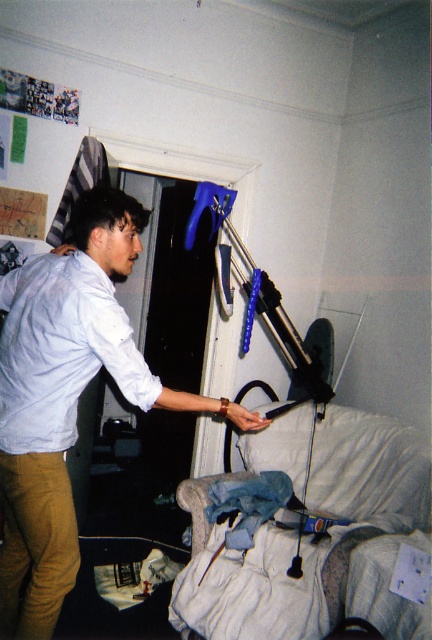
You are standing in the living room and want to know which of the two points, point (120, 364) or point (12, 333), is nearer to you. Based on the scene description, which point is closer?

Point (120, 364) is closer to the camera than point (12, 333), so the point closer to you is point (120, 364).

You are a nurse who needs to check the patient on the velvet blue hospital bed at lower right. Considering your height of 5 feet 6 inches, can you comfortably reach the bed controls located at the head of the bed without needing a stool?

The velvet blue hospital bed at lower right is 5.91 feet away from the camera. Since the bed controls are typically positioned at the head of the bed, and the distance from the camera to the bed is over 5 feet, the nurse would likely need to step closer or use a stool to comfortably reach the controls without straining.